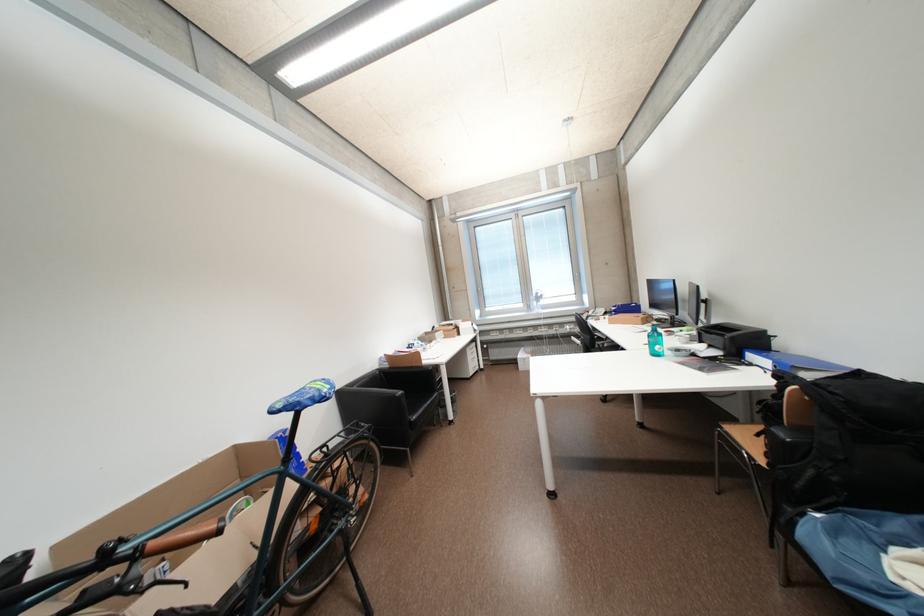
Find the location of `wooden chair sitting surface`. wooden chair sitting surface is located at coordinates (748, 430).